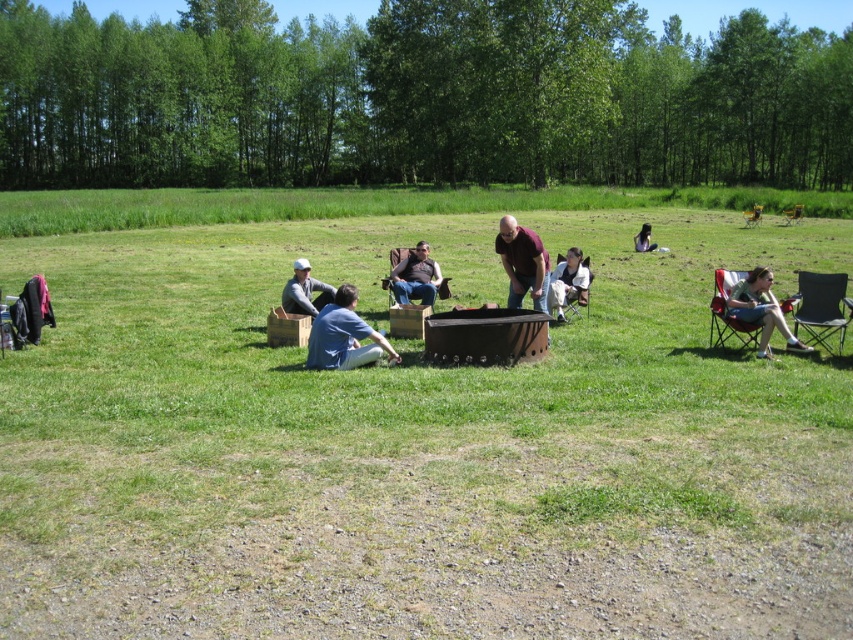
Identify the location of blue denim shirt at center. Image resolution: width=853 pixels, height=640 pixels. (344, 337).

Does blue denim shirt at center have a greater height compared to denim jacket at lower right?

No.

This screenshot has height=640, width=853. I want to click on blue denim shirt at center, so click(344, 337).

Is light blue denim jeans at lower right above yellow plastic chair at right?

No.

Measure the distance between light blue denim jeans at lower right and camera.

light blue denim jeans at lower right is 25.01 meters from camera.

Locate an element on the screen. This screenshot has height=640, width=853. light blue denim jeans at lower right is located at coordinates (643, 237).

Where is `light blue denim jeans at lower right`? Image resolution: width=853 pixels, height=640 pixels. light blue denim jeans at lower right is located at coordinates (643, 237).

Between black fabric chair at right and yellow fabric chair at right, which one has less height?

black fabric chair at right

Is black fabric chair at right bigger than yellow fabric chair at right?

No.

Find the location of a particular element. This screenshot has width=853, height=640. black fabric chair at right is located at coordinates click(821, 307).